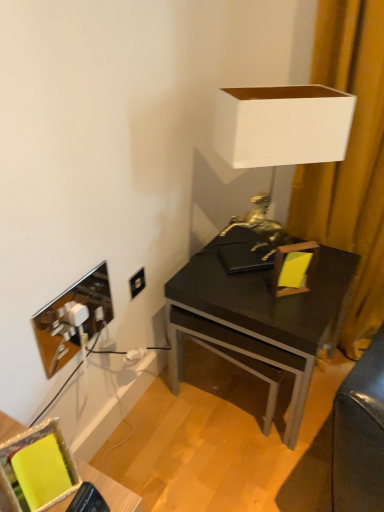
Locate an element on the screen. The width and height of the screenshot is (384, 512). blank space to the left of black matte drawer at center is located at coordinates (173, 416).